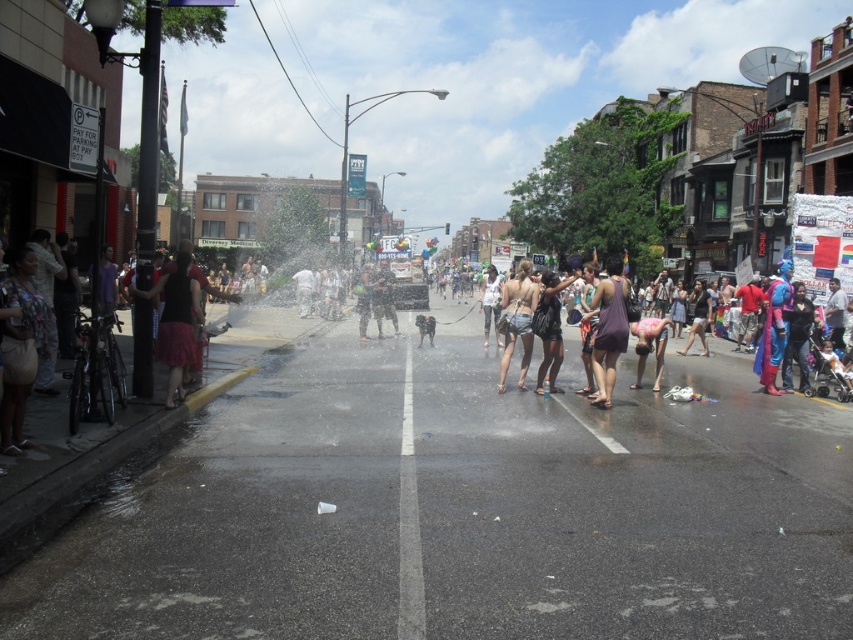
You are a photographer trying to capture a photo of the two people in the center of the street scene. The person wearing the matte purple dress at center is closer to the camera than the white cotton tank top at center. Which person should you focus on to ensure both are in the frame?

The matte purple dress at center is closer to the camera than the white cotton tank top at center. To ensure both are in the frame, focus on the matte purple dress at center first since it is closer, then adjust to include the white cotton tank top at center in the background.

Where is the matte purple dress at center located in the image?

The matte purple dress at center is located at point (x=608, y=333).

You are standing at the point marked as point (610,264) in the image. A friend is at the hydrant and wants to know how far you are from them. What do you tell them?

The distance between point (610,264) and the viewer is 31.81 feet, so you are 31.81 feet away from your friend at the hydrant.